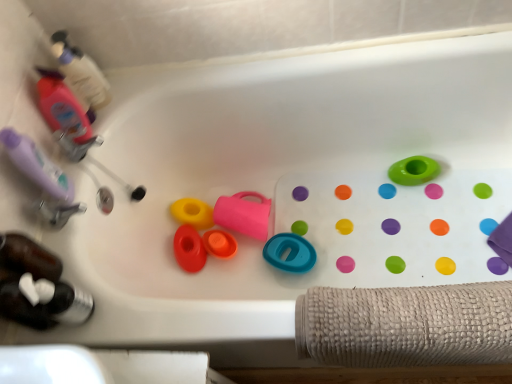
Where is `vacant space to the right of translucent pink bottle at upper left, the second bottle in the top-to-bottom sequence`? vacant space to the right of translucent pink bottle at upper left, the second bottle in the top-to-bottom sequence is located at coordinates (132, 102).